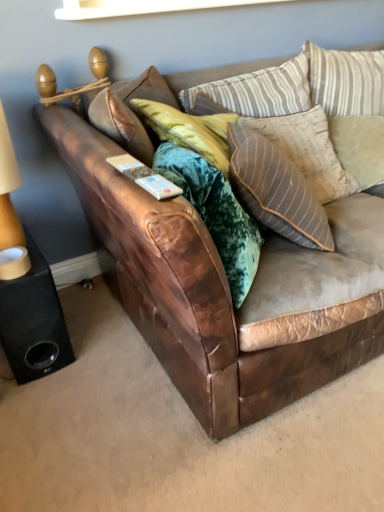
Question: In the image, is black matte speaker at lower left positioned in front of or behind brown leather couch at center?

Choices:
 (A) front
 (B) behind

Answer: (B)

Question: Is black matte speaker at lower left situated inside brown leather couch at center or outside?

Choices:
 (A) inside
 (B) outside

Answer: (B)

Question: Based on their relative distances, which object is nearer to the striped fabric pillow at upper center, the third pillow when ordered from right to left?

Choices:
 (A) brown leather couch at center
 (B) black matte speaker at lower left
 (C) beige fabric lampshade at left
 (D) beige textured pillow at upper right, arranged as the 1th pillow when viewed from the right
 (E) striped fabric pillow at upper right, placed as the 2th pillow when sorted from right to left

Answer: (E)

Question: Considering the real-world distances, which object is closest to the striped fabric pillow at upper right, the 2th pillow in the left-to-right sequence?

Choices:
 (A) black matte speaker at lower left
 (B) beige fabric lampshade at left
 (C) beige textured pillow at upper right, arranged as the 1th pillow when viewed from the right
 (D) brown leather couch at center
 (E) striped fabric pillow at upper center, the third pillow when ordered from right to left

Answer: (C)